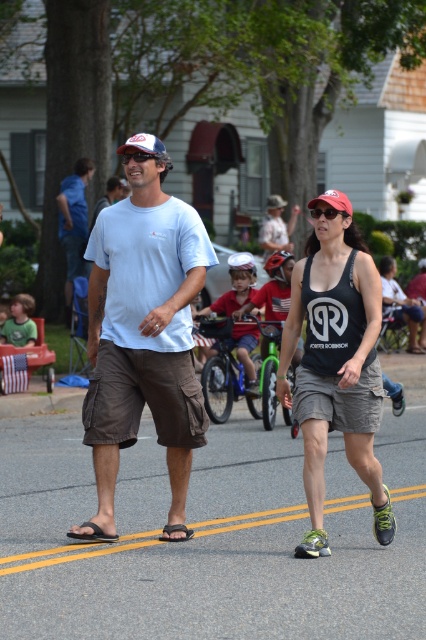
Find the location of `matte white t-shirt at center`. matte white t-shirt at center is located at coordinates (143, 333).

Between matte white t-shirt at center and matte blue t-shirt at center, which one is positioned lower?

matte white t-shirt at center is below.

Find the location of a particular element. matte white t-shirt at center is located at coordinates (143, 333).

Can you confirm if white cotton t-shirt at center is positioned above black tank top at center?

Indeed, white cotton t-shirt at center is positioned over black tank top at center.

Is white cotton t-shirt at center below black tank top at center?

Incorrect, white cotton t-shirt at center is not positioned below black tank top at center.

Is point (132, 307) farther from camera compared to point (339, 260)?

That is True.

Locate an element on the screen. The height and width of the screenshot is (640, 426). white cotton t-shirt at center is located at coordinates (141, 348).

Is point (333, 296) less distant than point (71, 214)?

Yes.

Which of these two, black tank top at center or matte blue t-shirt at center, stands taller?

matte blue t-shirt at center is taller.

Is point (333, 282) positioned after point (71, 250)?

No.

I want to click on black tank top at center, so click(x=336, y=364).